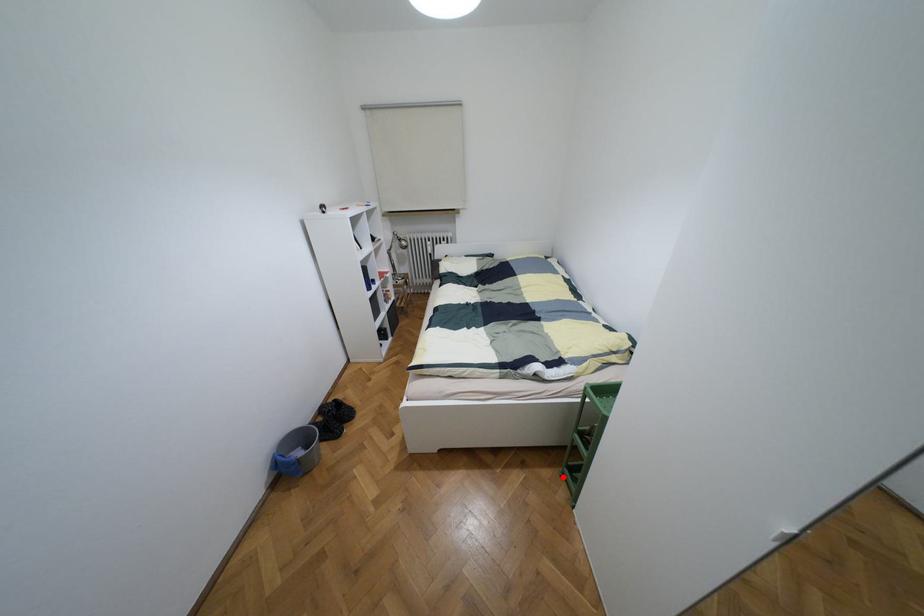
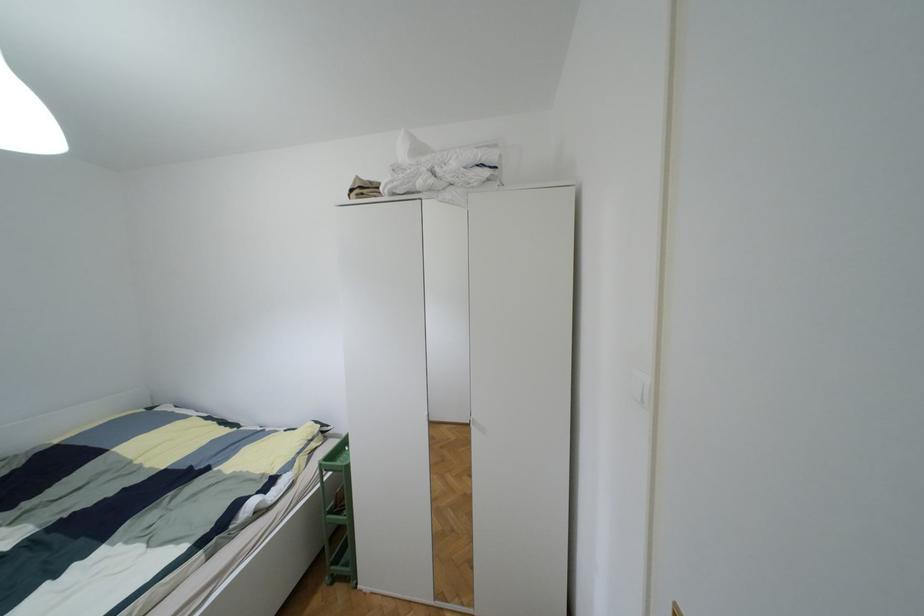
Locate, in the second image, the point that corresponds to the highlighted location in the first image.

(333, 578)